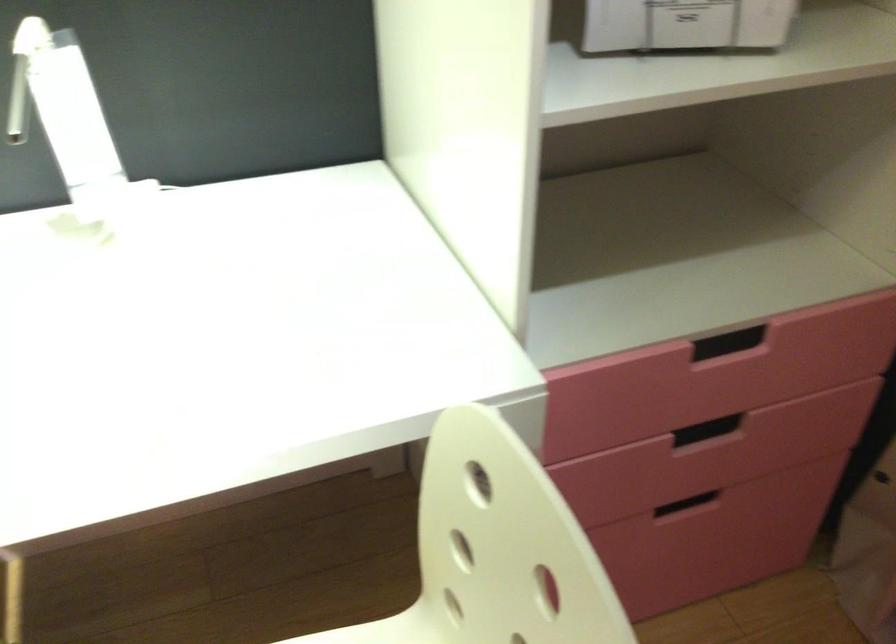
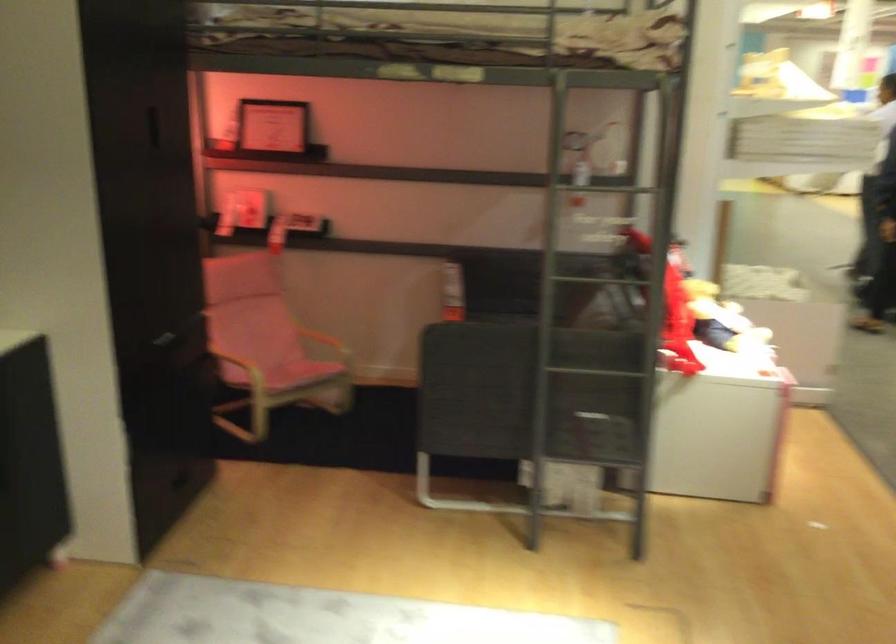
The images are taken continuously from a first-person perspective. In which direction is your viewpoint rotating?

The camera rotated toward left-down.